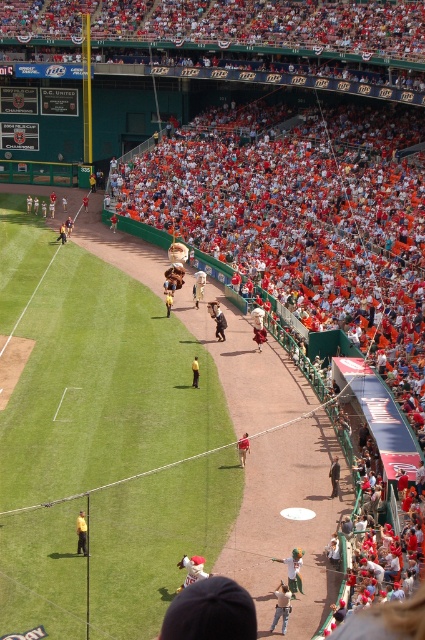
Between point (278, 557) and point (334, 486), which one is positioned behind?

The point (334, 486) is more distant.

Who is higher up, white cotton shirt at lower center or dark blue suit at center?

dark blue suit at center is above.

Is point (302, 561) in front of point (334, 468)?

Yes, point (302, 561) is closer to viewer.

You are a GUI agent. You are given a task and a screenshot of the screen. Output one action in this format:
    pyautogui.click(x=<x>, y=<y>)
    Task: Click on the white cotton shirt at lower center
    This screenshot has width=425, height=640.
    Given the screenshot: What is the action you would take?
    pyautogui.click(x=294, y=570)

Who is lower down, white cotton shirt at lower center or brown leather jacket at center?

white cotton shirt at lower center

Between point (291, 586) and point (223, 316), which one is positioned behind?

The point (223, 316) is more distant.

Who is more distant from viewer, (294,593) or (221,316)?

The point (221,316) is behind.

Locate an element on the screen. Image resolution: width=425 pixels, height=640 pixels. white cotton shirt at lower center is located at coordinates (294, 570).

Looking at this image, how much distance is there between brown leather jacket at center and red fabric person at center?

brown leather jacket at center and red fabric person at center are 14.96 meters apart from each other.

Who is taller, brown leather jacket at center or red fabric person at center?

brown leather jacket at center

Does point (221, 317) lie behind point (246, 444)?

That is True.

Find the location of a particular element. brown leather jacket at center is located at coordinates (220, 323).